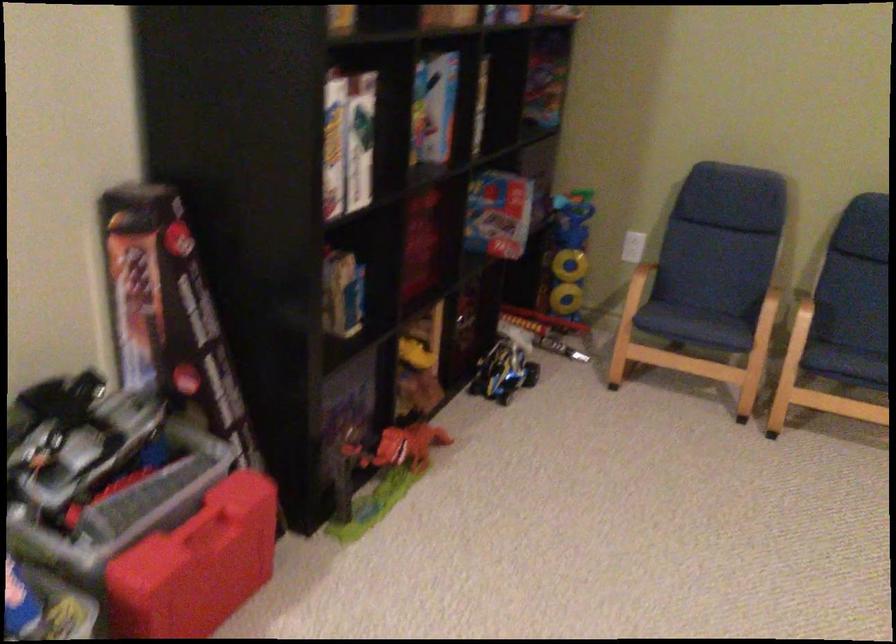
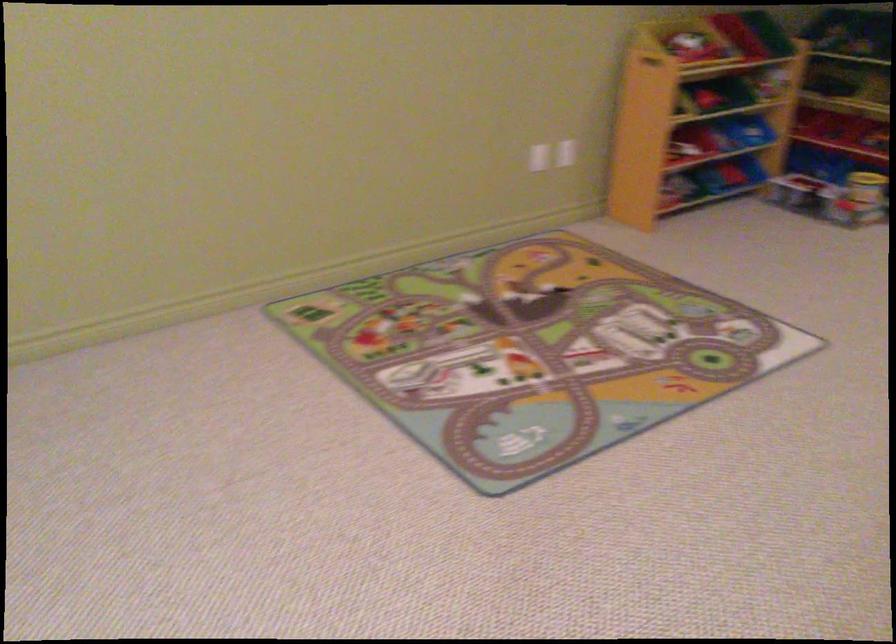
Question: The camera is either moving clockwise (left) or counter-clockwise (right) around the object. The first image is from the beginning of the video and the second image is from the end. Is the camera moving left or right when shooting the video?

Choices:
 (A) Left
 (B) Right

Answer: (A)